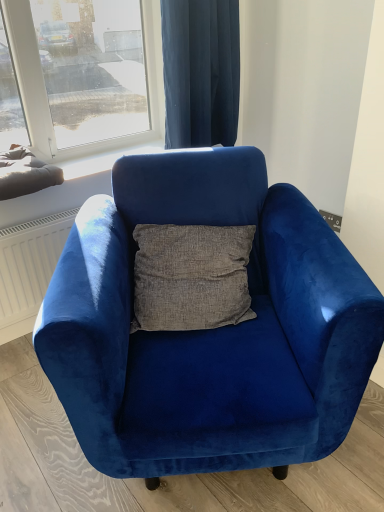
What do you see at coordinates (210, 330) in the screenshot?
I see `velvet blue armchair at center` at bounding box center [210, 330].

Identify the location of velvet blue armchair at center. (210, 330).

What do you see at coordinates (201, 71) in the screenshot? The width and height of the screenshot is (384, 512). I see `velvet blue curtain at upper center` at bounding box center [201, 71].

The width and height of the screenshot is (384, 512). Find the location of `velvet blue curtain at upper center`. velvet blue curtain at upper center is located at coordinates (201, 71).

The image size is (384, 512). In order to click on velvet blue armchair at center in this screenshot , I will do `click(210, 330)`.

Considering the relative positions of velvet blue curtain at upper center and velvet blue armchair at center in the image provided, is velvet blue curtain at upper center to the right of velvet blue armchair at center from the viewer's perspective?

Yes, velvet blue curtain at upper center is to the right of velvet blue armchair at center.

Is velvet blue curtain at upper center in front of or behind velvet blue armchair at center in the image?

velvet blue curtain at upper center is behind velvet blue armchair at center.

Considering the positions of points (208, 126) and (121, 180), is point (208, 126) closer to camera compared to point (121, 180)?

No, it is behind (121, 180).

From the image's perspective, which is above, velvet blue curtain at upper center or velvet blue armchair at center?

velvet blue curtain at upper center, from the image's perspective.

Based on the photo, from a real-world perspective, which is physically above, velvet blue curtain at upper center or velvet blue armchair at center?

velvet blue curtain at upper center.

In the scene shown: Is velvet blue curtain at upper center wider or thinner than velvet blue armchair at center?

In the image, velvet blue curtain at upper center appears to be more narrow than velvet blue armchair at center.

Does velvet blue curtain at upper center have a greater height compared to velvet blue armchair at center?

No.

Is velvet blue curtain at upper center bigger than velvet blue armchair at center?

No.

Is velvet blue armchair at center a part of velvet blue curtain at upper center?

No, velvet blue armchair at center is not inside velvet blue curtain at upper center.

Is there a large distance between velvet blue curtain at upper center and velvet blue armchair at center?

They are positioned close to each other.

Is velvet blue curtain at upper center oriented away from velvet blue armchair at center?

velvet blue curtain at upper center is not turned away from velvet blue armchair at center.

How different are the orientations of velvet blue curtain at upper center and velvet blue armchair at center in degrees?

There is a 33.7-degree angle between the facing directions of velvet blue curtain at upper center and velvet blue armchair at center.

Identify the location of chair that is on the left side of velvet blue curtain at upper center. The image size is (384, 512). (210, 330).

Considering the relative positions of velvet blue armchair at center and velvet blue curtain at upper center in the image provided, is velvet blue armchair at center to the right of velvet blue curtain at upper center from the viewer's perspective?

Incorrect, velvet blue armchair at center is not on the right side of velvet blue curtain at upper center.

In the scene shown: Who is more distant, velvet blue armchair at center or velvet blue curtain at upper center?

Positioned behind is velvet blue curtain at upper center.

Is point (310, 274) positioned in front of point (180, 135)?

Yes.

From the image's perspective, is velvet blue armchair at center above or below velvet blue curtain at upper center?

Clearly, from the image's perspective, velvet blue armchair at center is below velvet blue curtain at upper center.

From a real-world perspective, between velvet blue armchair at center and velvet blue curtain at upper center, who is vertically lower?

velvet blue armchair at center, from a real-world perspective.

From the picture: Does velvet blue armchair at center have a lesser width compared to velvet blue curtain at upper center?

In fact, velvet blue armchair at center might be wider than velvet blue curtain at upper center.

Is velvet blue armchair at center shorter than velvet blue curtain at upper center?

No.

Who is smaller, velvet blue armchair at center or velvet blue curtain at upper center?

velvet blue curtain at upper center.

Is velvet blue armchair at center outside of velvet blue curtain at upper center?

Yes, velvet blue armchair at center is located beyond the bounds of velvet blue curtain at upper center.

Would you consider velvet blue armchair at center to be distant from velvet blue curtain at upper center?

No, velvet blue armchair at center is not far away from velvet blue curtain at upper center.

Is velvet blue armchair at center positioned with its back to velvet blue curtain at upper center?

Yes, velvet blue armchair at center is facing away from velvet blue curtain at upper center.

Can you tell me how much velvet blue armchair at center and velvet blue curtain at upper center differ in facing direction?

There is a 33.7-degree angle between the facing directions of velvet blue armchair at center and velvet blue curtain at upper center.

Measure the distance between velvet blue armchair at center and velvet blue curtain at upper center.

velvet blue armchair at center is 35.94 inches away from velvet blue curtain at upper center.

Locate an element on the screen. chair directly beneath the velvet blue curtain at upper center (from a real-world perspective) is located at coordinates (210, 330).

Locate an element on the screen. chair below the velvet blue curtain at upper center (from the image's perspective) is located at coordinates (210, 330).

Image resolution: width=384 pixels, height=512 pixels. Identify the location of curtain to the right of velvet blue armchair at center. (201, 71).